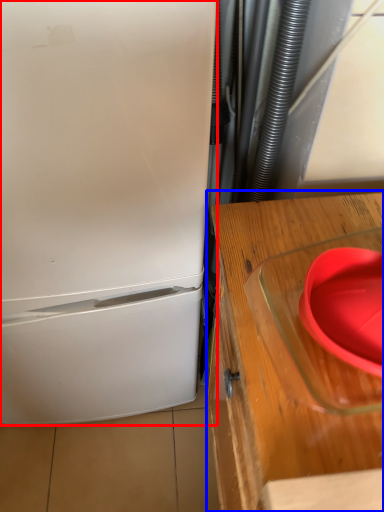
Question: Among these objects, which one is nearest to the camera, refrigerator (highlighted by a red box) or table (highlighted by a blue box)?

Choices:
 (A) refrigerator
 (B) table

Answer: (A)